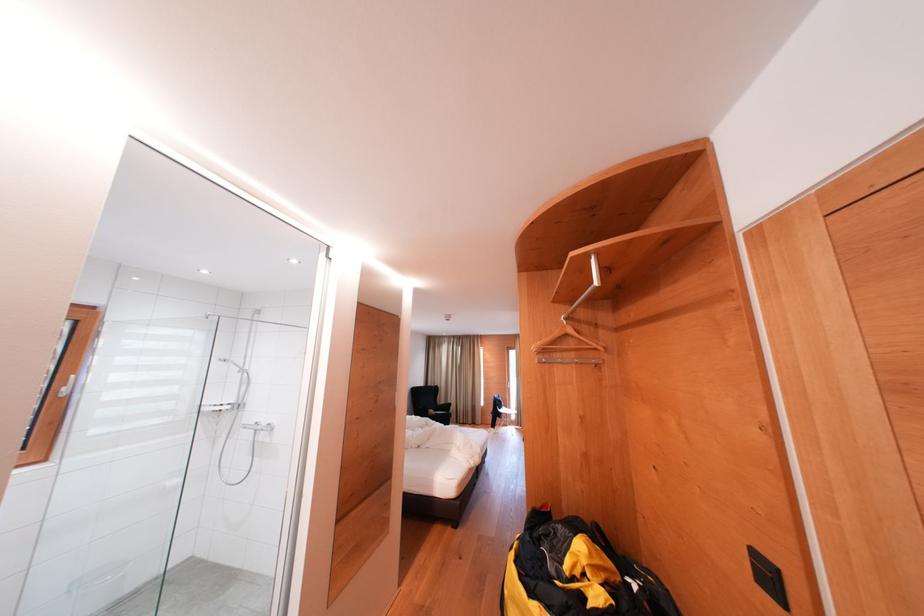
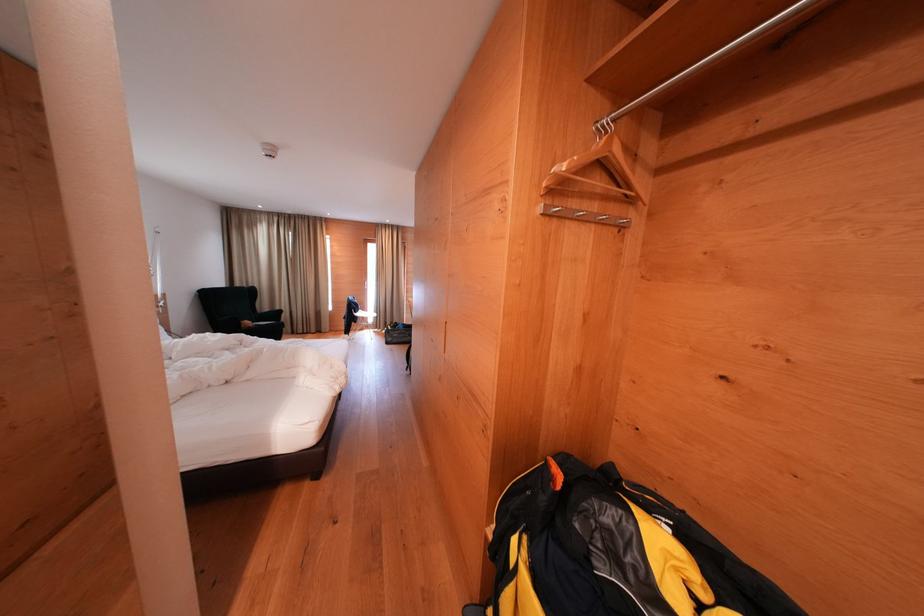
Locate, in the second image, the point that corresponds to (439,416) in the first image.

(254, 328)